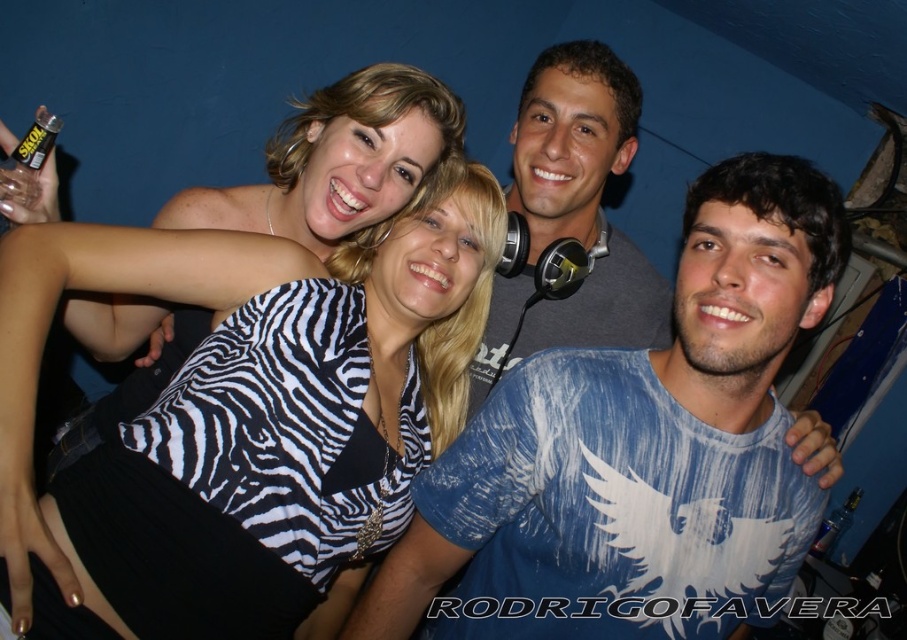
You are at a party and want to place the gray matte headphones at center and the clear plastic bottle at lower right on a small shelf that can only hold items up to the size of the smaller object. Which item should you choose?

The clear plastic bottle at lower right is smaller than the gray matte headphones at center, so you should choose the clear plastic bottle at lower right to place on the shelf.